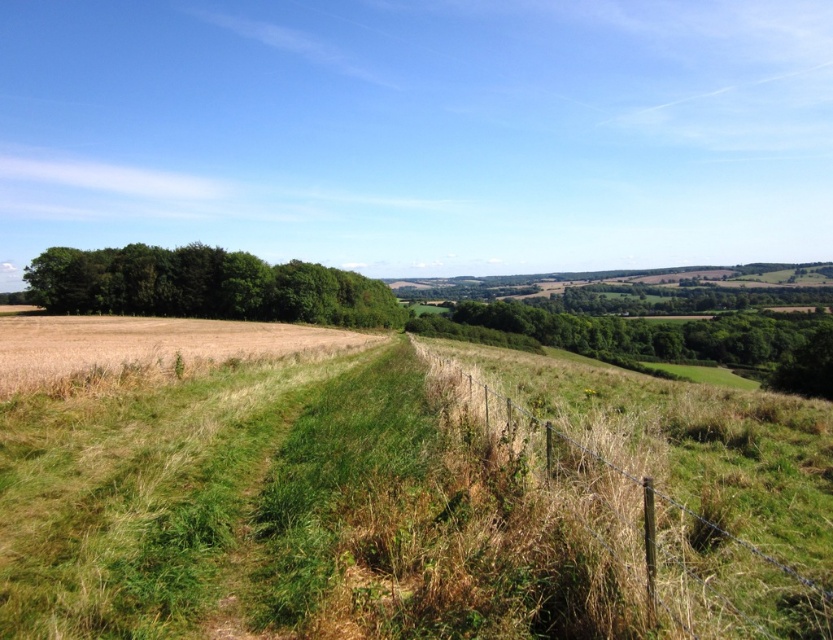
Is brown wire fence at right to the right of golden matte wheat field at left from the viewer's perspective?

Indeed, brown wire fence at right is positioned on the right side of golden matte wheat field at left.

This screenshot has height=640, width=833. What do you see at coordinates (682, 481) in the screenshot? I see `brown wire fence at right` at bounding box center [682, 481].

Which is behind, point (549, 401) or point (157, 321)?

The point (157, 321) is more distant.

You are a GUI agent. You are given a task and a screenshot of the screen. Output one action in this format:
    pyautogui.click(x=<x>, y=<y>)
    Task: Click on the brown wire fence at right
    The height and width of the screenshot is (640, 833).
    Given the screenshot: What is the action you would take?
    pyautogui.click(x=682, y=481)

Is brown wire fence at right further to camera compared to green leafy trees at left?

No, it is not.

Can you confirm if brown wire fence at right is positioned to the left of green leafy trees at left?

Incorrect, brown wire fence at right is not on the left side of green leafy trees at left.

Between point (831, 618) and point (101, 300), which one is positioned behind?

The point (101, 300) is behind.

You are a GUI agent. You are given a task and a screenshot of the screen. Output one action in this format:
    pyautogui.click(x=<x>, y=<y>)
    Task: Click on the brown wire fence at right
    Image resolution: width=833 pixels, height=640 pixels.
    Given the screenshot: What is the action you would take?
    pyautogui.click(x=682, y=481)

Is point (110, 285) positioned behind point (35, 362)?

Yes, it is behind point (35, 362).

Find the location of a particular element. The height and width of the screenshot is (640, 833). green leafy trees at left is located at coordinates (205, 285).

Find the location of a particular element. The width and height of the screenshot is (833, 640). green leafy trees at left is located at coordinates (205, 285).